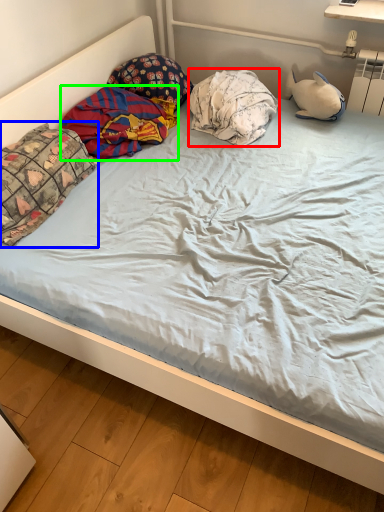
Question: Based on their relative distances, which object is farther from pillow (highlighted by a red box)? Choose from pillow (highlighted by a blue box) and material (highlighted by a green box).

Choices:
 (A) pillow
 (B) material

Answer: (A)